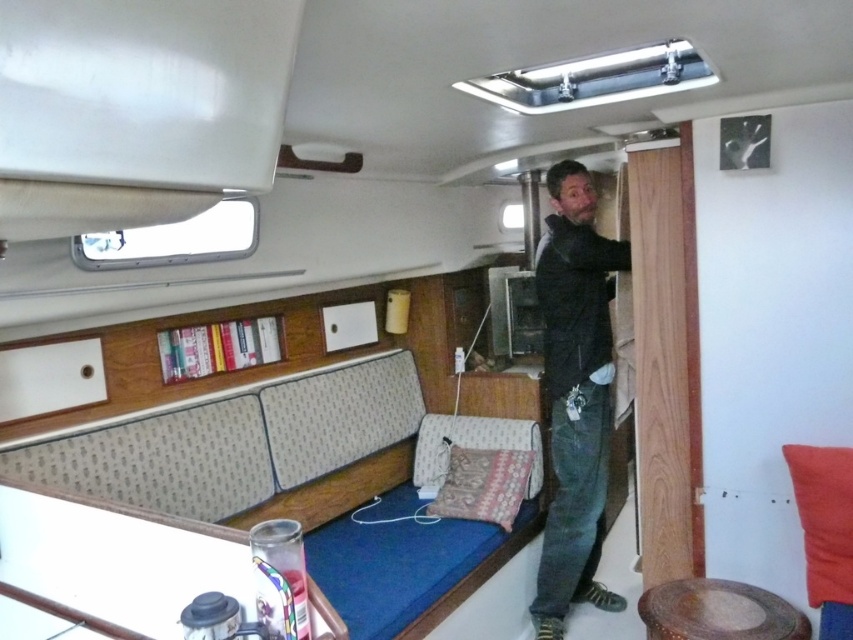
You are organizing a small party in the boat cabin and need to place a 1.5 meter long table between the patterned fabric couch at lower left and the dark gray leather jacket at center. Will the space between them be sufficient to fit the table?

The patterned fabric couch at lower left is larger in size than the dark gray leather jacket at center, but the exact distance between them isn not specified. Without knowing the actual spacing, it is impossible to determine if the 1.5 meter table will fit.

You are organizing a small gathering in the boat cabin and need to seat two guests. The patterned fabric couch at lower left and the patterned fabric pillow at lower center are available. Which seating option can accommodate more people?

The patterned fabric couch at lower left has a larger width than the patterned fabric pillow at lower center, so it can accommodate more people.